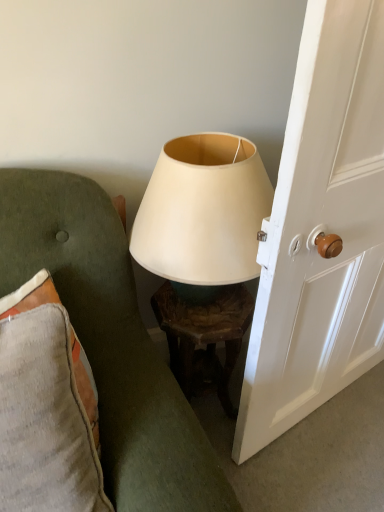
Question: From a real-world perspective, is textured gray cushion at left located higher than textured gray pillow at left?

Choices:
 (A) no
 (B) yes

Answer: (B)

Question: Are textured gray cushion at left and textured gray pillow at left making contact?

Choices:
 (A) yes
 (B) no

Answer: (B)

Question: Does textured gray cushion at left contain textured gray pillow at left?

Choices:
 (A) yes
 (B) no

Answer: (A)

Question: Does textured gray cushion at left appear on the right side of textured gray pillow at left?

Choices:
 (A) yes
 (B) no

Answer: (A)

Question: Does textured gray cushion at left appear on the left side of textured gray pillow at left?

Choices:
 (A) no
 (B) yes

Answer: (A)

Question: Can you confirm if textured gray cushion at left is shorter than textured gray pillow at left?

Choices:
 (A) no
 (B) yes

Answer: (A)

Question: Considering the relative sizes of textured gray cushion at left and matte white lampshade at center in the image provided, is textured gray cushion at left taller than matte white lampshade at center?

Choices:
 (A) no
 (B) yes

Answer: (B)

Question: Is matte white lampshade at center surrounded by textured gray cushion at left?

Choices:
 (A) yes
 (B) no

Answer: (B)

Question: Is textured gray cushion at left positioned in front of matte white lampshade at center?

Choices:
 (A) no
 (B) yes

Answer: (B)

Question: Is textured gray cushion at left shorter than matte white lampshade at center?

Choices:
 (A) yes
 (B) no

Answer: (B)

Question: Considering the relative sizes of textured gray cushion at left and matte white lampshade at center in the image provided, is textured gray cushion at left smaller than matte white lampshade at center?

Choices:
 (A) no
 (B) yes

Answer: (A)

Question: Considering the relative positions of textured gray cushion at left and matte white lampshade at center in the image provided, is textured gray cushion at left to the right of matte white lampshade at center from the viewer's perspective?

Choices:
 (A) no
 (B) yes

Answer: (A)

Question: From a real-world perspective, is wooden textured table at center positioned over matte white lampshade at center based on gravity?

Choices:
 (A) yes
 (B) no

Answer: (B)